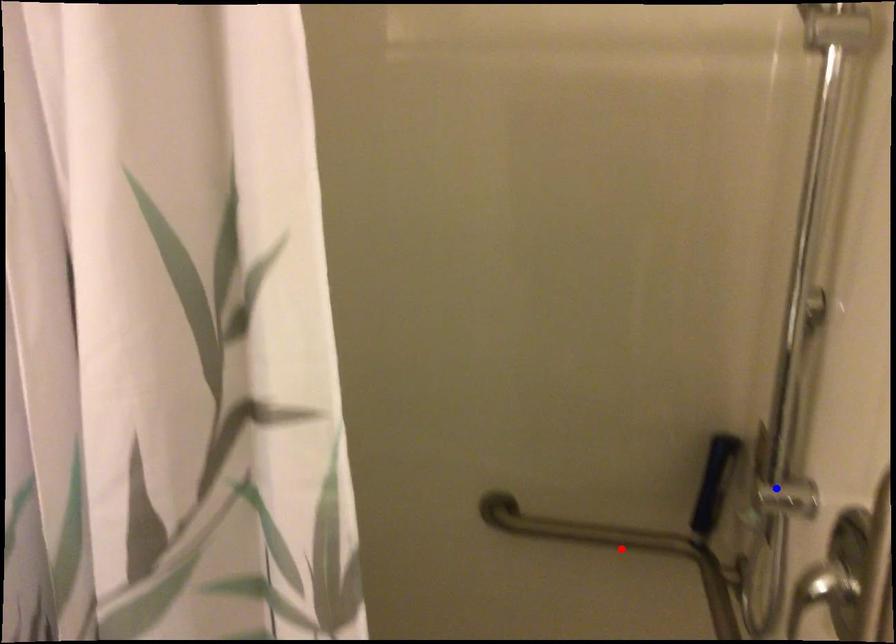
Question: In the image, two points are highlighted. Which point is nearer to the camera? Reply with the corresponding letter.

Choices:
 (A) blue point
 (B) red point

Answer: (A)